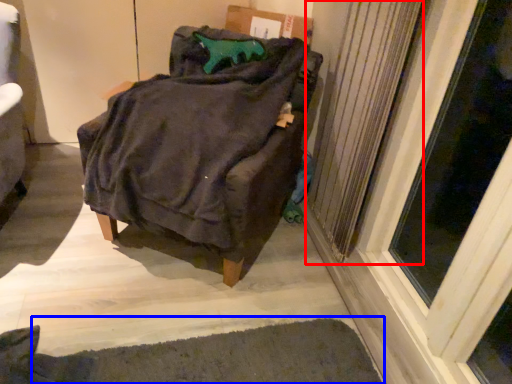
Question: Which object is further to the camera taking this photo, radiator (highlighted by a red box) or doormat (highlighted by a blue box)?

Choices:
 (A) radiator
 (B) doormat

Answer: (A)